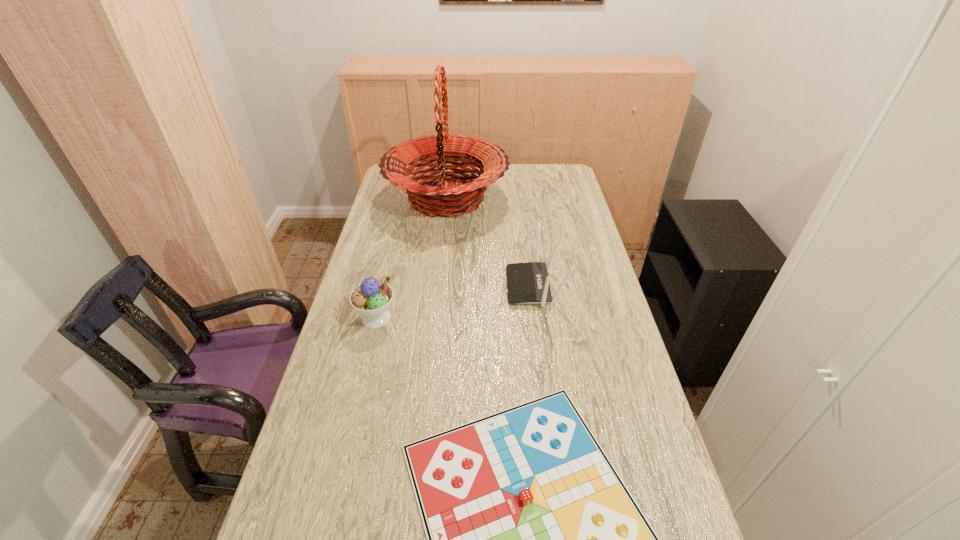
Locate an element on the screen. The height and width of the screenshot is (540, 960). the tallest object is located at coordinates (447, 197).

The width and height of the screenshot is (960, 540). Find the location of `basket`. basket is located at coordinates (447, 197).

What are the coordinates of `router` in the screenshot? It's located at (528, 283).

This screenshot has height=540, width=960. Identify the location of icecream. (372, 298).

Find the location of a particular element. This screenshot has height=540, width=960. vacant space located 0.060m on the front of the basket is located at coordinates (442, 244).

At what (x,y) coordinates should I click in order to perform the action: click on vacant position located 0.380m on the front-facing side of the router. Please return your answer as a coordinate pair (x, y). Looking at the image, I should click on (391, 286).

I want to click on free point located 0.300m on the front-facing side of the router, so click(x=416, y=286).

Locate an element on the screen. free space located 0.400m on the front-facing side of the router is located at coordinates (385, 286).

Where is `vacant region located 0.400m on the back of the icecream`? vacant region located 0.400m on the back of the icecream is located at coordinates (397, 230).

Where is `object located in the far edge section of the desktop`? The width and height of the screenshot is (960, 540). object located in the far edge section of the desktop is located at coordinates (447, 197).